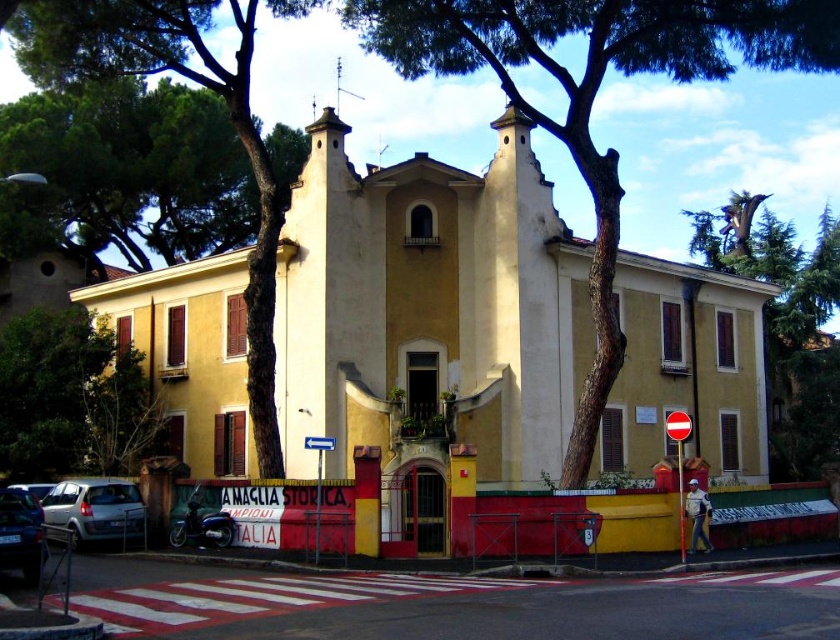
Question: Is yellow matte building at center bigger than green rough bark tree at center?

Choices:
 (A) no
 (B) yes

Answer: (A)

Question: Which of the following is the farthest from the observer?

Choices:
 (A) (536, 29)
 (B) (714, 248)
 (C) (11, 532)
 (D) (55, 522)

Answer: (B)

Question: Does yellow matte building at center have a larger size compared to green leafy tree at upper right?

Choices:
 (A) no
 (B) yes

Answer: (A)

Question: Which object is farther from the camera taking this photo?

Choices:
 (A) metallic silver car at lower left
 (B) green rough bark tree at center

Answer: (B)

Question: Which point appears farthest from the camera in this image?

Choices:
 (A) (84, 508)
 (B) (40, 33)
 (C) (286, 218)

Answer: (C)

Question: From the image, what is the correct spatial relationship of green leafy tree at upper right in relation to metallic silver car at lower left?

Choices:
 (A) right
 (B) left

Answer: (A)